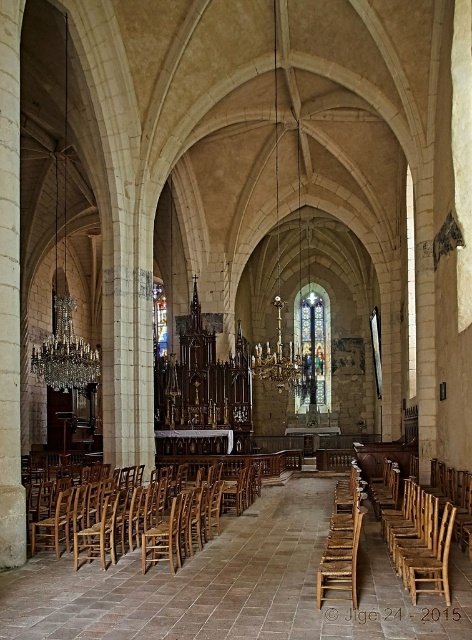
Question: Which of the following is the farthest from the observer?

Choices:
 (A) (160, 554)
 (B) (416, 497)

Answer: (A)

Question: Which point appears farthest from the camera in this image?

Choices:
 (A) (337, 564)
 (B) (354, 490)

Answer: (B)

Question: Does rustic wood chair at right have a lesser width compared to worn wood chair at center?

Choices:
 (A) no
 (B) yes

Answer: (A)

Question: Can you confirm if wooden chair at left is positioned to the left of worn wood chair at center?

Choices:
 (A) no
 (B) yes

Answer: (B)

Question: Is rustic wood chair at right to the right of worn wood chair at center from the viewer's perspective?

Choices:
 (A) yes
 (B) no

Answer: (A)

Question: Which point appears closest to the camera in this image?

Choices:
 (A) (339, 492)
 (B) (327, 586)

Answer: (B)